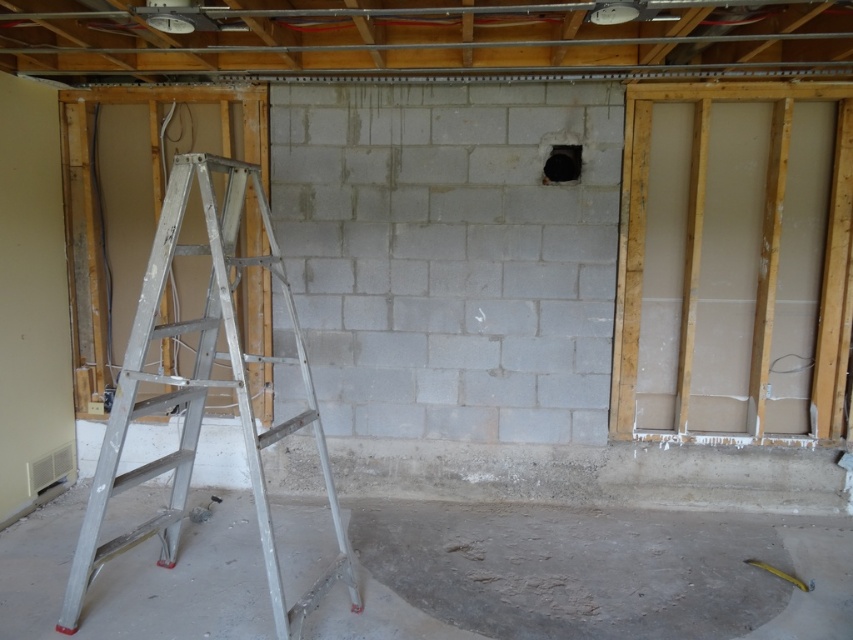
Question: From the image, what is the correct spatial relationship of smooth concrete floor at lower center in relation to silver metallic ladder at left?

Choices:
 (A) below
 (B) above

Answer: (A)

Question: Which of the following is the closest to the observer?

Choices:
 (A) (201, 385)
 (B) (140, 637)

Answer: (A)

Question: Is smooth concrete floor at lower center behind silver metallic ladder at left?

Choices:
 (A) no
 (B) yes

Answer: (B)

Question: Can you confirm if smooth concrete floor at lower center is wider than silver metallic ladder at left?

Choices:
 (A) yes
 (B) no

Answer: (A)